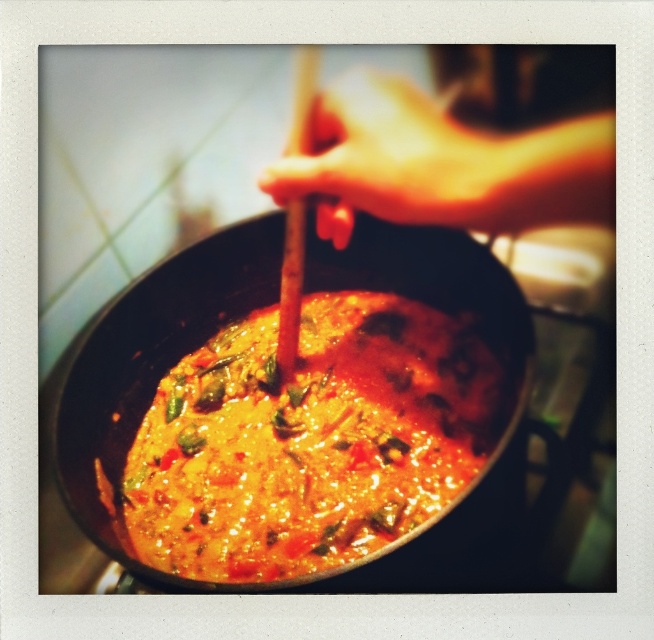
Does yellow-orange sauce at center appear under smooth wooden spoon at center?

Indeed, yellow-orange sauce at center is positioned under smooth wooden spoon at center.

Is point (264, 358) more distant than point (472, 152)?

Yes, point (264, 358) is farther from viewer.

Locate an element on the screen. yellow-orange sauce at center is located at coordinates (307, 440).